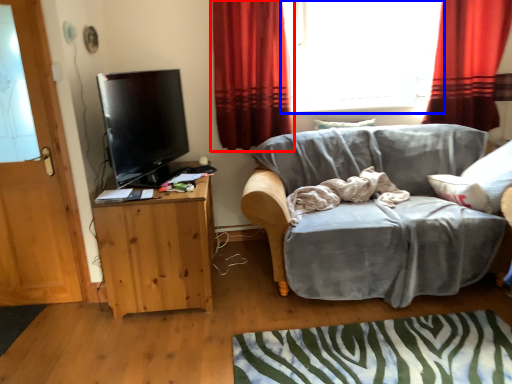
Question: Which object is closer to the camera taking this photo, curtain (highlighted by a red box) or window (highlighted by a blue box)?

Choices:
 (A) curtain
 (B) window

Answer: (A)